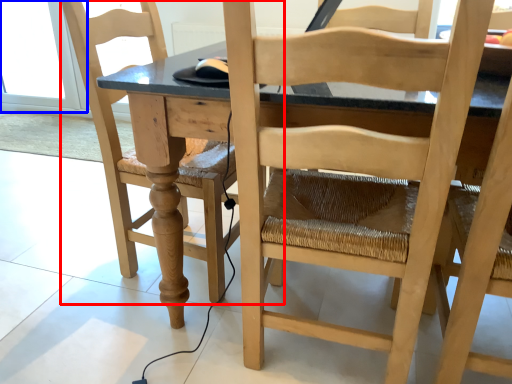
Question: Which of the following is the farthest to the observer, chair (highlighted by a red box) or glass door (highlighted by a blue box)?

Choices:
 (A) chair
 (B) glass door

Answer: (B)